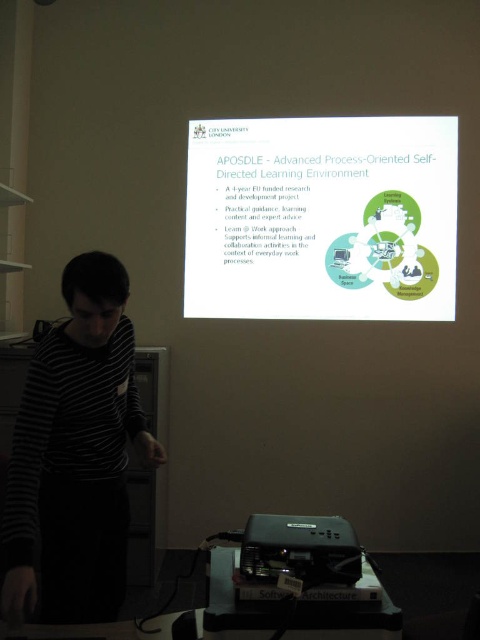
Can you confirm if white glossy projector screen at upper center is positioned to the right of black plastic projector at lower center?

Correct, you'll find white glossy projector screen at upper center to the right of black plastic projector at lower center.

Between point (264, 232) and point (338, 579), which one is positioned in front?

Point (338, 579) is in front.

I want to click on white glossy projector screen at upper center, so click(322, 218).

Is white glossy projector screen at upper center positioned behind black striped shirt at left?

Yes, it is.

Does white glossy projector screen at upper center have a lesser width compared to black striped shirt at left?

In fact, white glossy projector screen at upper center might be wider than black striped shirt at left.

Which is behind, point (364, 179) or point (134, 408)?

Point (364, 179)

Identify the location of white glossy projector screen at upper center. (322, 218).

Is black striped shirt at left below black plastic projector at lower center?

No.

Measure the distance between black striped shirt at left and camera.

A distance of 4.45 feet exists between black striped shirt at left and camera.

At what (x,y) coordinates should I click in order to perform the action: click on black striped shirt at left. Please return your answer as a coordinate pair (x, y). The height and width of the screenshot is (640, 480). Looking at the image, I should click on (75, 456).